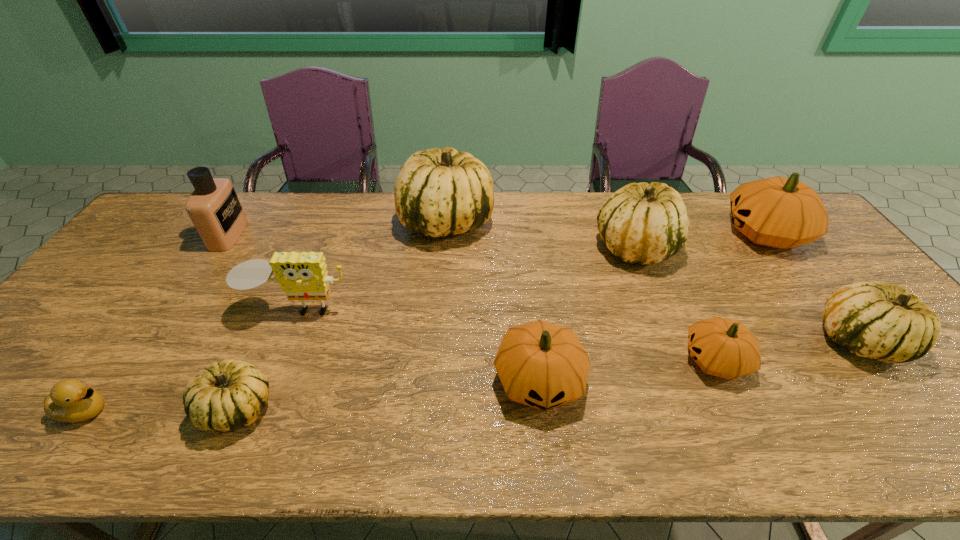
At what (x,y) coordinates should I click in order to perform the action: click on the third white gourd from right to left. Please return your answer as a coordinate pair (x, y). This screenshot has height=540, width=960. Looking at the image, I should click on (439, 192).

The image size is (960, 540). I want to click on perfume, so pos(214,208).

The height and width of the screenshot is (540, 960). In order to click on the biggest orange gourd in this screenshot , I will do `click(778, 212)`.

Locate an element on the screen. the farthest orange gourd is located at coordinates [x=778, y=212].

You are a GUI agent. You are given a task and a screenshot of the screen. Output one action in this format:
    pyautogui.click(x=<x>, y=<y>)
    Task: Click on the second biggest white gourd
    
    Given the screenshot: What is the action you would take?
    pyautogui.click(x=643, y=223)

Locate an element on the screen. sponge is located at coordinates (303, 276).

Locate an element on the screen. The height and width of the screenshot is (540, 960). the leftmost orange gourd is located at coordinates (543, 365).

Locate an element on the screen. the third farthest white gourd is located at coordinates (872, 319).

Locate an element on the screen. the third biggest white gourd is located at coordinates (872, 319).

Identify the location of the smallest orange gourd. The height and width of the screenshot is (540, 960). (721, 347).